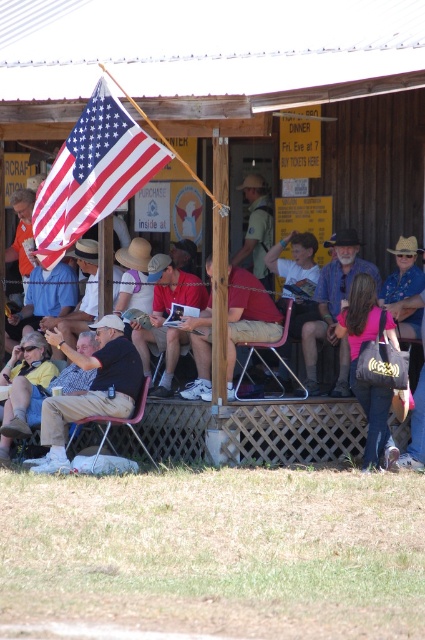
You are a photographer trying to capture a photo of the wooden hut at center and the matte black jacket at lower left. Based on their heights, which object should you focus on first if you want to ensure both are fully visible in the frame?

The wooden hut at center is not as tall as the matte black jacket at lower left, so you should focus on the matte black jacket at lower left first to ensure its full height is captured before adjusting the frame to include the shorter wooden hut at center.

You are a photographer setting up a tripod to capture the scene. You need to ensure that both the american flag at upper left and the matte black jacket at lower left are in frame. Given their relative sizes, which object should you focus on first to ensure proper framing?

The american flag at upper left has a greater height compared to the matte black jacket at lower left. To ensure proper framing, focus on the american flag at upper left first since it is taller and requires more space in the composition.

You are standing at the point labeled as point (x=90, y=388) in the image. What object or feature is located exactly at that coordinate?

The point (x=90, y=388) corresponds to the plaid shirt at center.